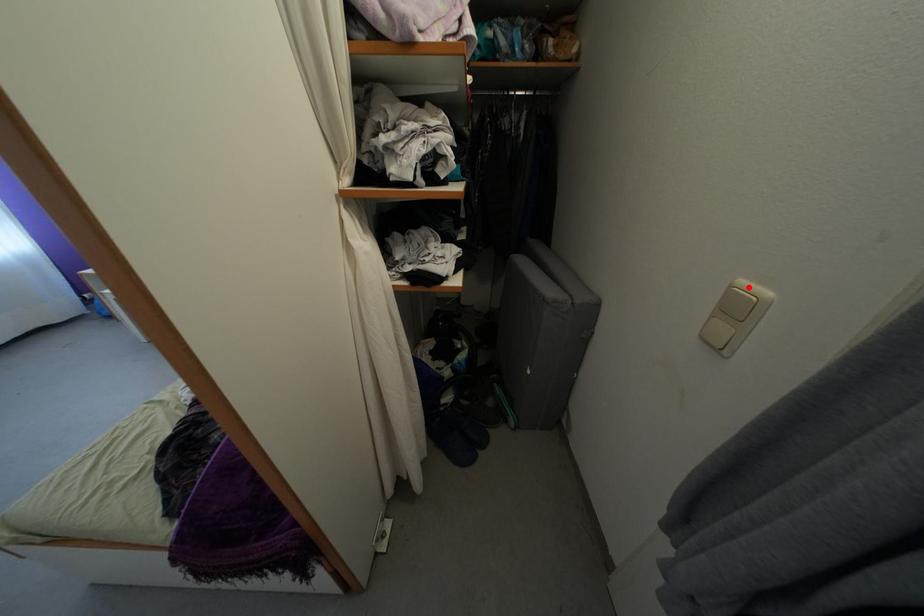
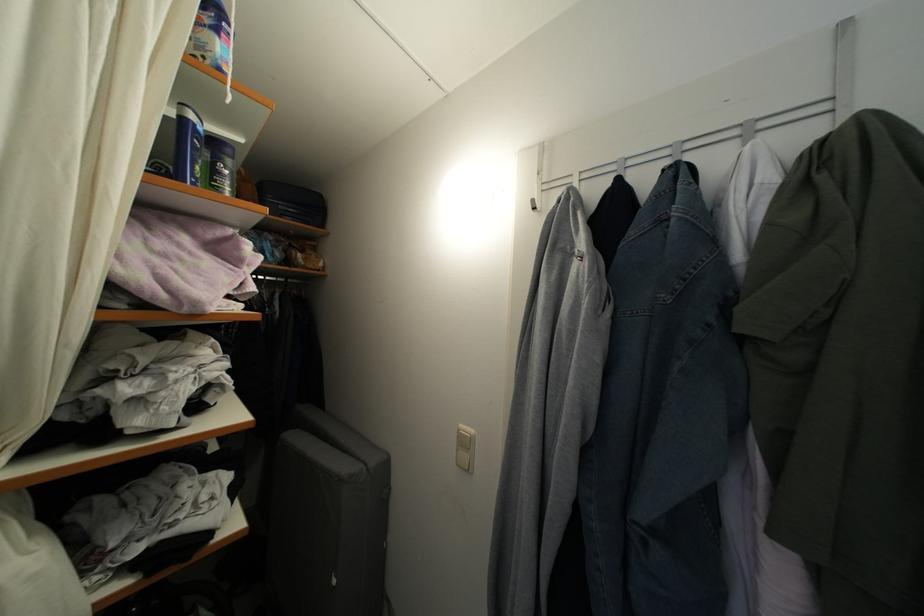
Locate, in the second image, the point that corresponds to the highlighted location in the first image.

(467, 432)